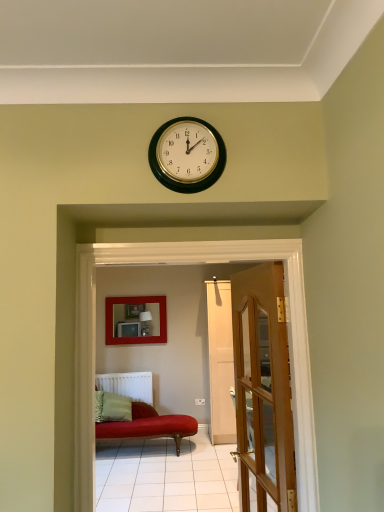
Question: Should I look upward or downward to see matte red picture frame at center?

Choices:
 (A) down
 (B) up

Answer: (A)

Question: Considering the relative positions of green fabric pillow at lower left and white matte radiator at lower left in the image provided, is green fabric pillow at lower left in front of white matte radiator at lower left?

Choices:
 (A) yes
 (B) no

Answer: (A)

Question: Would you say green fabric pillow at lower left is outside white matte radiator at lower left?

Choices:
 (A) no
 (B) yes

Answer: (B)

Question: Does green fabric pillow at lower left have a larger size compared to white matte radiator at lower left?

Choices:
 (A) yes
 (B) no

Answer: (A)

Question: Is the depth of green fabric pillow at lower left greater than that of white matte radiator at lower left?

Choices:
 (A) yes
 (B) no

Answer: (B)

Question: Does green fabric pillow at lower left appear on the left side of white matte radiator at lower left?

Choices:
 (A) yes
 (B) no

Answer: (A)

Question: From the image's perspective, is green fabric pillow at lower left beneath white matte radiator at lower left?

Choices:
 (A) yes
 (B) no

Answer: (A)

Question: Does wooden glass door at center appear on the left side of white matte radiator at lower left?

Choices:
 (A) yes
 (B) no

Answer: (B)

Question: Is wooden glass door at center oriented towards white matte radiator at lower left?

Choices:
 (A) yes
 (B) no

Answer: (B)

Question: Does wooden glass door at center have a greater height compared to white matte radiator at lower left?

Choices:
 (A) yes
 (B) no

Answer: (A)

Question: Can you see wooden glass door at center touching white matte radiator at lower left?

Choices:
 (A) no
 (B) yes

Answer: (A)

Question: From a real-world perspective, is wooden glass door at center physically above white matte radiator at lower left?

Choices:
 (A) no
 (B) yes

Answer: (B)

Question: Does wooden glass door at center have a greater width compared to white matte radiator at lower left?

Choices:
 (A) yes
 (B) no

Answer: (B)

Question: Is wooden glass door at center shorter than green fabric pillow at lower left?

Choices:
 (A) no
 (B) yes

Answer: (A)